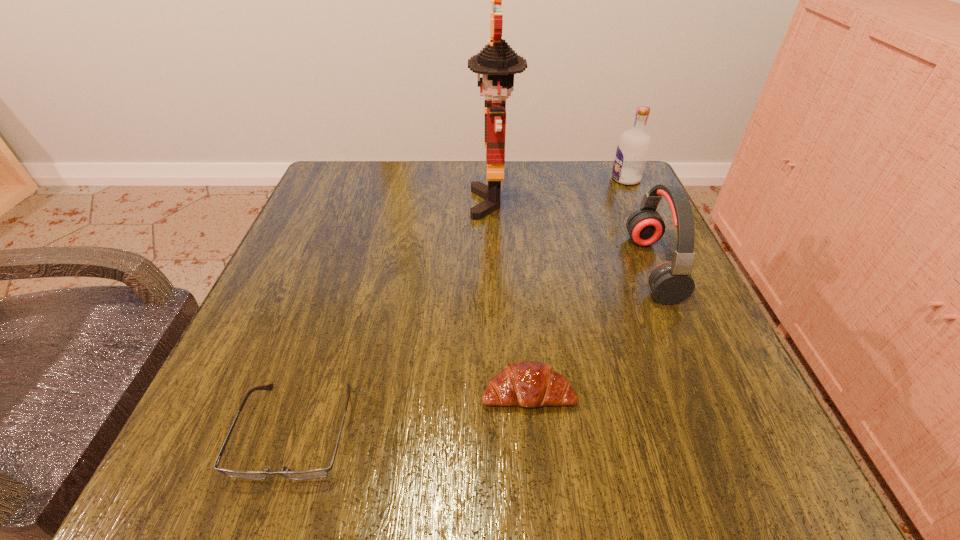
Image resolution: width=960 pixels, height=540 pixels. Find the location of `nutcracker`. nutcracker is located at coordinates click(497, 62).

Locate an element on the screen. This screenshot has height=540, width=960. vodka is located at coordinates (633, 148).

Locate an element on the screen. Image resolution: width=960 pixels, height=540 pixels. earphone is located at coordinates (671, 282).

At what (x,y) coordinates should I click in order to perform the action: click on the fourth tallest object. Please return your answer as a coordinate pair (x, y). The image size is (960, 540). Looking at the image, I should click on (530, 384).

Where is `the leftmost object`? This screenshot has height=540, width=960. the leftmost object is located at coordinates (318, 473).

Locate an element on the screen. Image resolution: width=960 pixels, height=540 pixels. the shortest object is located at coordinates (318, 473).

The image size is (960, 540). I want to click on vacant space located on the front-facing side of the nutcracker, so click(x=383, y=204).

This screenshot has width=960, height=540. Identify the location of vacant space located on the front-facing side of the nutcracker. (414, 204).

This screenshot has width=960, height=540. I want to click on vacant space located on the front-facing side of the nutcracker, so click(309, 204).

Locate an element on the screen. The image size is (960, 540). vacant region located on the label of the vodka is located at coordinates click(531, 179).